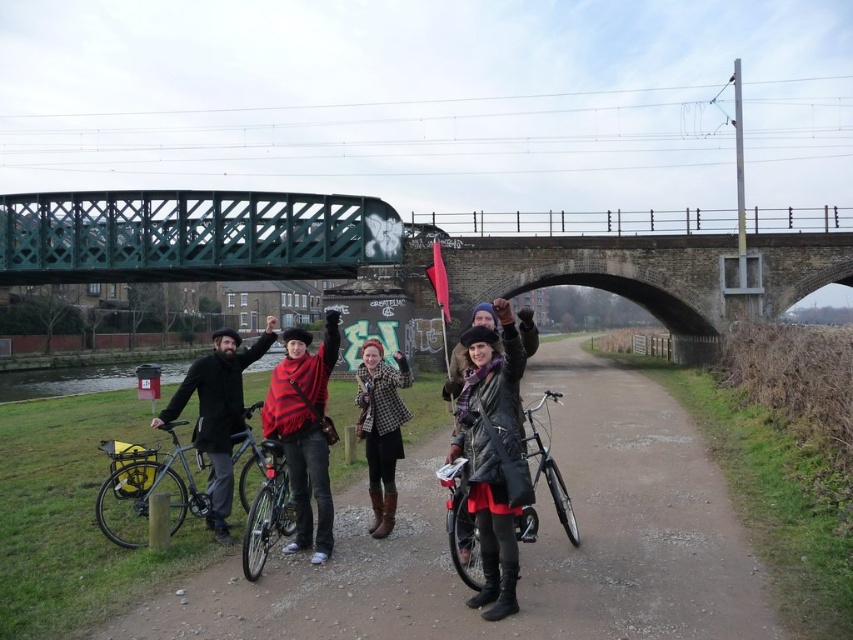
You are a pedestrian trying to walk from the dirt path at center to the shiny metallic bicycle at center. Which direction should you move to get closer to the bicycle?

Since the dirt path at center is closer to the viewer than the shiny metallic bicycle at center, you should move forward towards the bicycle to get closer to it.

You are a photographer trying to capture a clear shot of the shiny metallic bicycle at center without the green metal bridge at upper center blocking it. What should you do?

Move your position to a lower angle so that the shiny metallic bicycle at center is no longer obstructed by the green metal bridge at upper center.

You are planning to walk along the dirt path at center with your group. Since the shiny metallic bicycle at center is parked there, will there be enough space for your group to walk comfortably?

The dirt path at center is bigger than the shiny metallic bicycle at center, so there should be enough space for the group to walk comfortably around the bicycle.